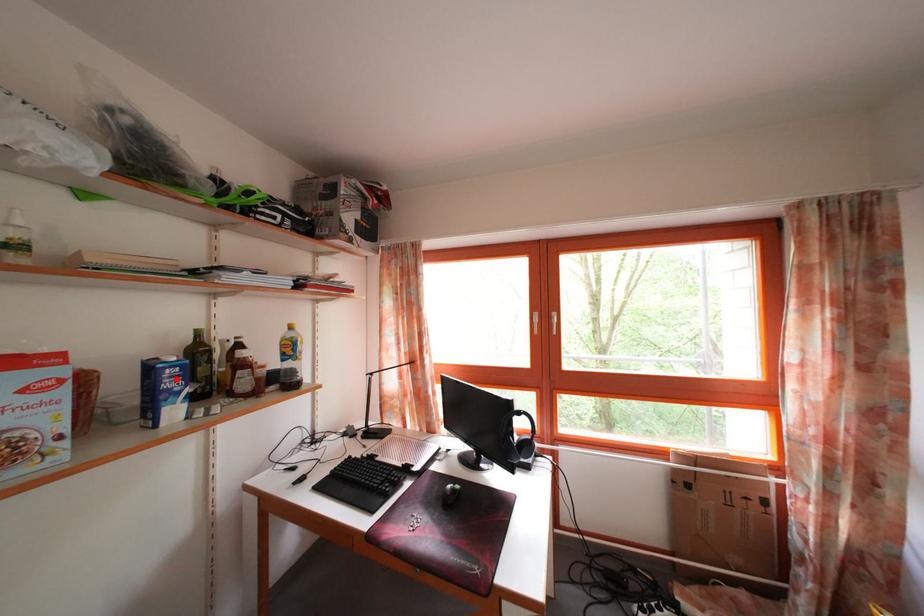
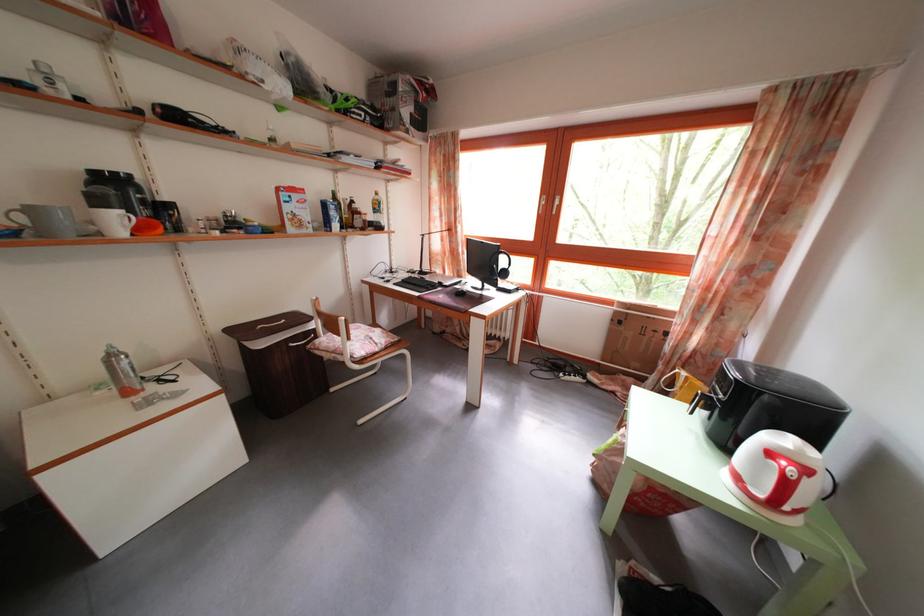
In the second image, find the point that corresponds to the highlighted location in the first image.

(338, 214)